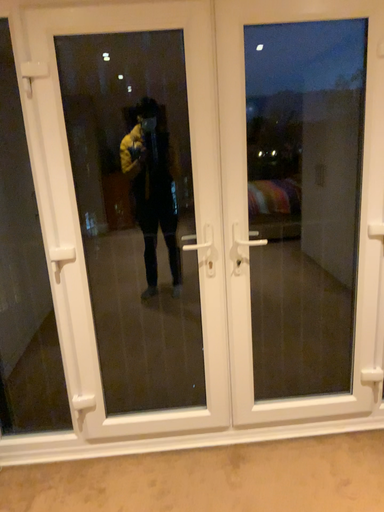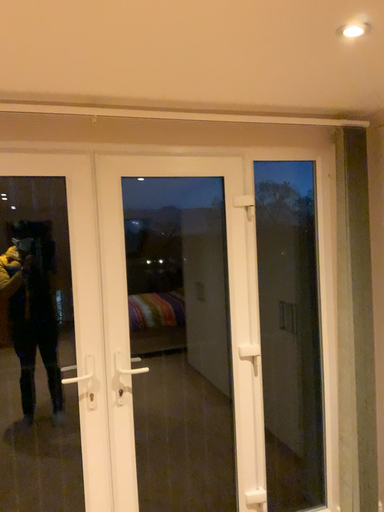
Question: How did the camera likely rotate when shooting the video?

Choices:
 (A) rotated left
 (B) rotated right

Answer: (B)